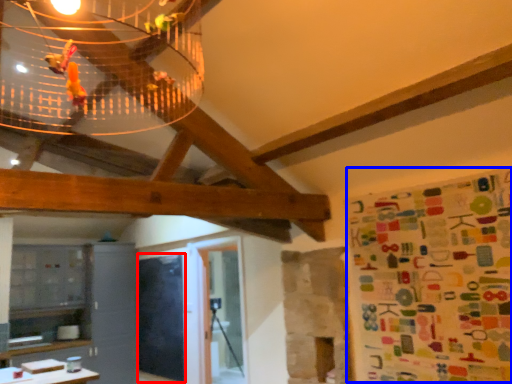
Question: Which object appears closest to the camera in this image, bulletin board (highlighted by a red box) or wrapping paper (highlighted by a blue box)?

Choices:
 (A) bulletin board
 (B) wrapping paper

Answer: (B)